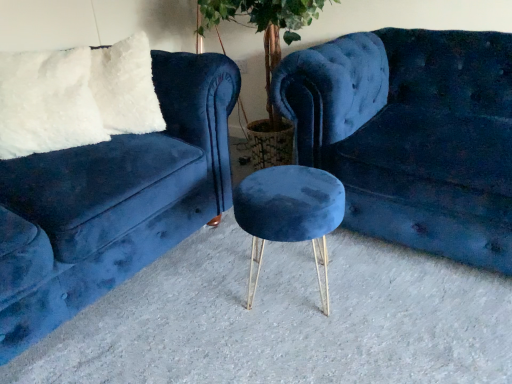
Question: Does velvet blue couch at left, the first studio couch when ordered from left to right, have a greater width compared to velvet blue stool at center?

Choices:
 (A) no
 (B) yes

Answer: (B)

Question: Does velvet blue couch at left, the second studio couch when ordered from right to left, contain velvet blue stool at center?

Choices:
 (A) yes
 (B) no

Answer: (B)

Question: Is velvet blue couch at left, the first studio couch when ordered from left to right, far from velvet blue stool at center?

Choices:
 (A) yes
 (B) no

Answer: (B)

Question: Is velvet blue couch at left, the first studio couch when ordered from left to right, not inside velvet blue stool at center?

Choices:
 (A) yes
 (B) no

Answer: (A)

Question: Considering the relative sizes of velvet blue couch at left, the second studio couch when ordered from right to left, and velvet blue stool at center in the image provided, is velvet blue couch at left, the second studio couch when ordered from right to left, thinner than velvet blue stool at center?

Choices:
 (A) yes
 (B) no

Answer: (B)

Question: In terms of width, does velvet blue couch at left, the second studio couch when ordered from right to left, look wider or thinner when compared to white fluffy pillow at upper left?

Choices:
 (A) wide
 (B) thin

Answer: (A)

Question: Is velvet blue couch at left, the second studio couch when ordered from right to left, inside the boundaries of white fluffy pillow at upper left, or outside?

Choices:
 (A) inside
 (B) outside

Answer: (B)

Question: From the image's perspective, is velvet blue couch at left, the first studio couch when ordered from left to right, above or below white fluffy pillow at upper left?

Choices:
 (A) below
 (B) above

Answer: (A)

Question: From a real-world perspective, is velvet blue couch at left, the first studio couch when ordered from left to right, above or below white fluffy pillow at upper left?

Choices:
 (A) below
 (B) above

Answer: (A)

Question: Is point (376, 236) positioned closer to the camera than point (99, 294)?

Choices:
 (A) closer
 (B) farther

Answer: (B)

Question: Is velvet blue couch at center, arranged as the first studio couch when viewed from the right, in front of or behind velvet blue couch at left, the second studio couch when ordered from right to left, in the image?

Choices:
 (A) front
 (B) behind

Answer: (B)

Question: From a real-world perspective, is velvet blue couch at center, placed as the 2th studio couch when sorted from left to right, physically located above or below velvet blue couch at left, the second studio couch when ordered from right to left?

Choices:
 (A) below
 (B) above

Answer: (A)

Question: Would you say velvet blue couch at center, placed as the 2th studio couch when sorted from left to right, is to the left or to the right of velvet blue couch at left, the second studio couch when ordered from right to left, in the picture?

Choices:
 (A) right
 (B) left

Answer: (A)

Question: Would you say velvet blue stool at center is inside or outside velvet blue couch at center, placed as the 2th studio couch when sorted from left to right?

Choices:
 (A) outside
 (B) inside

Answer: (A)

Question: Considering the positions of velvet blue stool at center and velvet blue couch at center, placed as the 2th studio couch when sorted from left to right, in the image, is velvet blue stool at center wider or thinner than velvet blue couch at center, placed as the 2th studio couch when sorted from left to right,?

Choices:
 (A) wide
 (B) thin

Answer: (B)